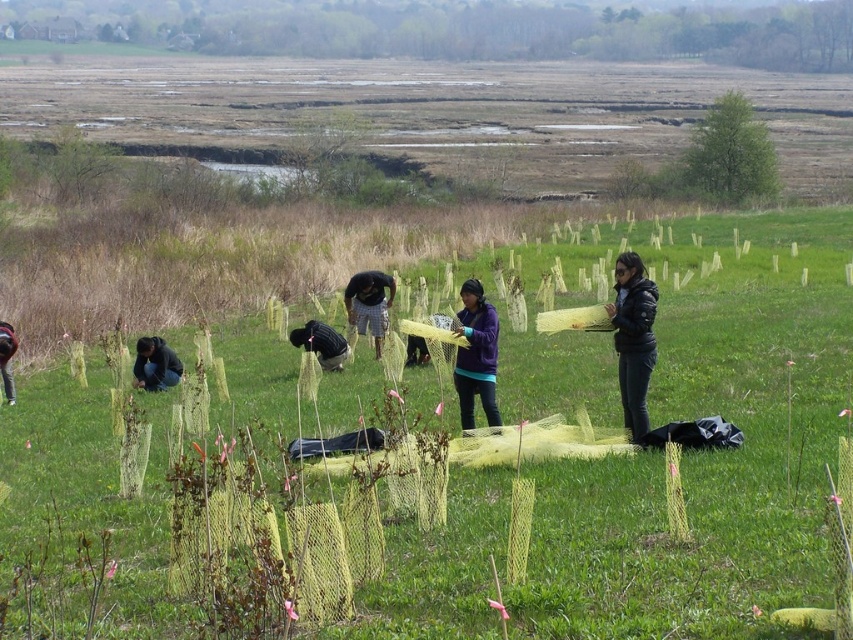
Who is taller, green grassy at center or dark blue jacket at center?

Standing taller between the two is green grassy at center.

The image size is (853, 640). Find the location of `green grassy at center`. green grassy at center is located at coordinates [x=711, y=458].

Does green grass at upper center lie in front of black matte jacket at center?

No.

This screenshot has height=640, width=853. What are the coordinates of `green grass at upper center` in the screenshot? It's located at (467, 28).

At what (x,y) coordinates should I click in order to perform the action: click on green grass at upper center. Please return your answer as a coordinate pair (x, y). This screenshot has width=853, height=640. Looking at the image, I should click on (467, 28).

Locate an element on the screen. The image size is (853, 640). green grass at upper center is located at coordinates (467, 28).

Between point (138, 356) and point (325, 352), which one is positioned in front?

Point (138, 356)

Does matte black jacket at lower left appear under dark blue jacket at center?

Yes, matte black jacket at lower left is below dark blue jacket at center.

Identify the location of matte black jacket at lower left. Image resolution: width=853 pixels, height=640 pixels. (155, 364).

This screenshot has width=853, height=640. Find the location of `matte black jacket at lower left`. matte black jacket at lower left is located at coordinates (155, 364).